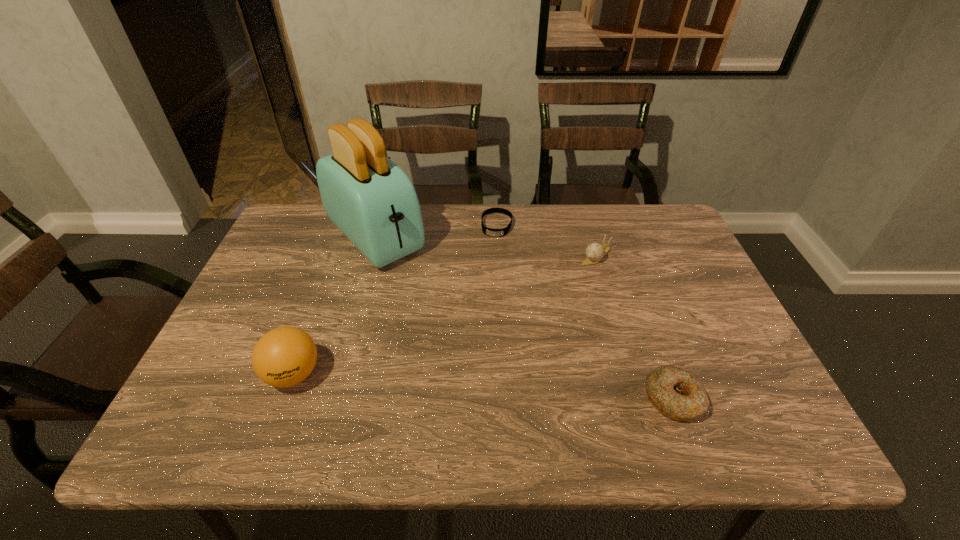
The width and height of the screenshot is (960, 540). Find the location of `free location located 0.230m on the shell of the escargot`. free location located 0.230m on the shell of the escargot is located at coordinates (545, 313).

In order to click on free space located on the shell of the escargot in this screenshot , I will do `click(545, 313)`.

Image resolution: width=960 pixels, height=540 pixels. In order to click on vacant region located 0.210m on the shell of the escargot in this screenshot , I will do point(549,308).

Locate an element on the screen. Image resolution: width=960 pixels, height=540 pixels. vacant space located on the display of the third object from right to left is located at coordinates (486, 291).

Where is `free region located 0.060m on the display of the third object from right to left`? This screenshot has height=540, width=960. free region located 0.060m on the display of the third object from right to left is located at coordinates (493, 251).

Where is `vacant area located on the display of the third object from right to left`? This screenshot has height=540, width=960. vacant area located on the display of the third object from right to left is located at coordinates (492, 257).

Find the location of `toaster that is positioned at the far edge`. toaster that is positioned at the far edge is located at coordinates (372, 201).

Image resolution: width=960 pixels, height=540 pixels. I want to click on escargot located at the far edge, so [595, 251].

You are a GUI agent. You are given a task and a screenshot of the screen. Output one action in this format:
    pyautogui.click(x=<x>, y=<y>)
    Task: Click on the wristband that is positioned at the far edge
    The width and height of the screenshot is (960, 540).
    Given the screenshot: What is the action you would take?
    pyautogui.click(x=487, y=231)

The height and width of the screenshot is (540, 960). In order to click on ping-pong ball that is at the near edge in this screenshot , I will do `click(285, 356)`.